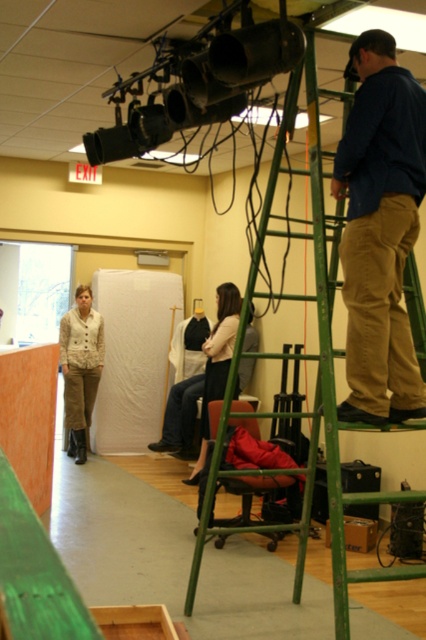
Question: Is matte black video camera at upper center to the left of green metal ladder at upper right from the viewer's perspective?

Choices:
 (A) no
 (B) yes

Answer: (B)

Question: Among these objects, which one is nearest to the camera?

Choices:
 (A) white fabric at center
 (B) dark blue cotton shirt at upper right
 (C) matte black video camera at upper center

Answer: (B)

Question: Is dark blue cotton shirt at upper right thinner than green metal ladder at upper right?

Choices:
 (A) no
 (B) yes

Answer: (B)

Question: Which object appears closest to the camera in this image?

Choices:
 (A) dark blue cotton shirt at upper right
 (B) green metal ladder at upper right
 (C) white fabric at center
 (D) matte black video camera at upper center

Answer: (B)

Question: Is matte black video camera at upper center wider than white fabric at center?

Choices:
 (A) yes
 (B) no

Answer: (A)

Question: Which point is farther from the camera taking this photo?

Choices:
 (A) (213, 35)
 (B) (376, 321)

Answer: (A)